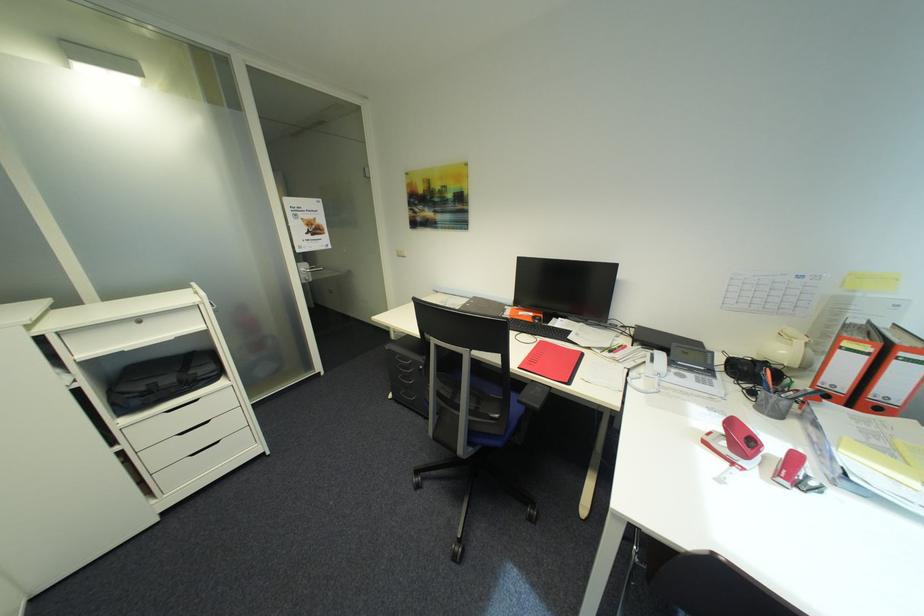
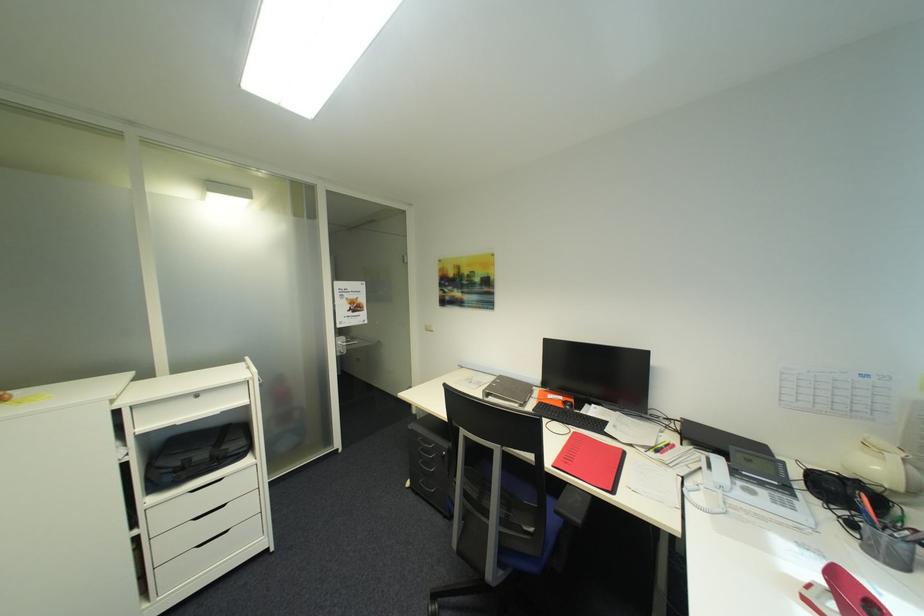
Find the pixel in the second image that matches pixel 176 407 in the first image.

(202, 485)